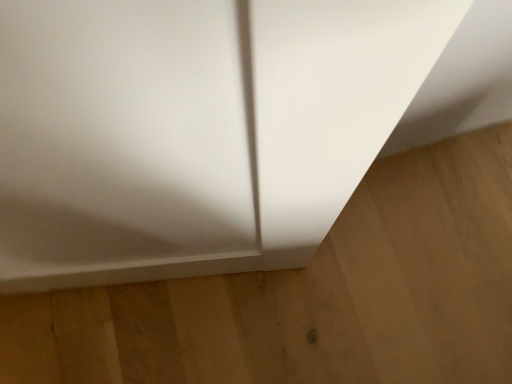
You are a GUI agent. You are given a task and a screenshot of the screen. Output one action in this format:
    pyautogui.click(x=<x>, y=<y>)
    Task: Click on the matte wood floor at lower right
    Image resolution: width=512 pixels, height=384 pixels.
    Given the screenshot: What is the action you would take?
    pyautogui.click(x=313, y=295)

What do you see at coordinates (313, 295) in the screenshot?
I see `matte wood floor at lower right` at bounding box center [313, 295].

The image size is (512, 384). Identify the location of matte wood floor at lower right. (313, 295).